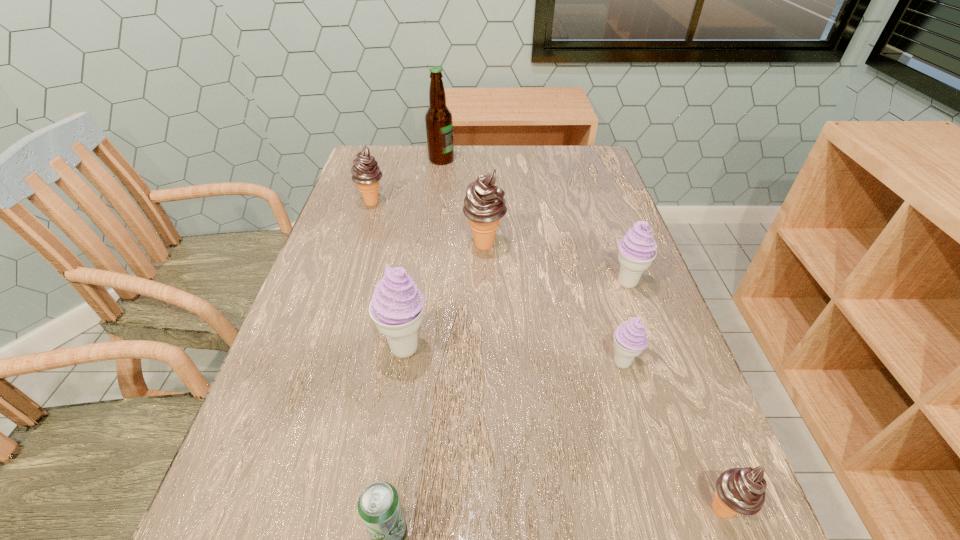
Find the location of a particular element. The height and width of the screenshot is (540, 960). object present at the far edge is located at coordinates (439, 124).

Locate an element on the screen. The image size is (960, 540). object present at the left edge is located at coordinates (366, 173).

This screenshot has width=960, height=540. In the image, there is a desktop. Identify the location of vacant space at the far edge. (536, 168).

Identify the location of vacant space at the left edge. (340, 361).

In the image, there is a desktop. Identify the location of vacant space at the right edge. Image resolution: width=960 pixels, height=540 pixels. (580, 221).

You are a GUI agent. You are given a task and a screenshot of the screen. Output one action in this format:
    pyautogui.click(x=<x>, y=<y>)
    Task: Click on the free space between the fourth object from right to left and the farthest icecream
    
    Given the screenshot: What is the action you would take?
    (x=428, y=224)

The image size is (960, 540). Identify the location of vacant area between the leftmost purple icecream and the brown beer bottle. click(x=423, y=254).

Find the location of a particular element. This screenshot has width=960, height=540. free space between the second farthest object and the smallest chocolate icecream is located at coordinates (547, 356).

The height and width of the screenshot is (540, 960). I want to click on free space between the rightmost chocolate icecream and the brown beer bottle, so click(582, 335).

This screenshot has height=540, width=960. I want to click on vacant region between the fourth object from right to left and the tallest object, so coord(463,202).